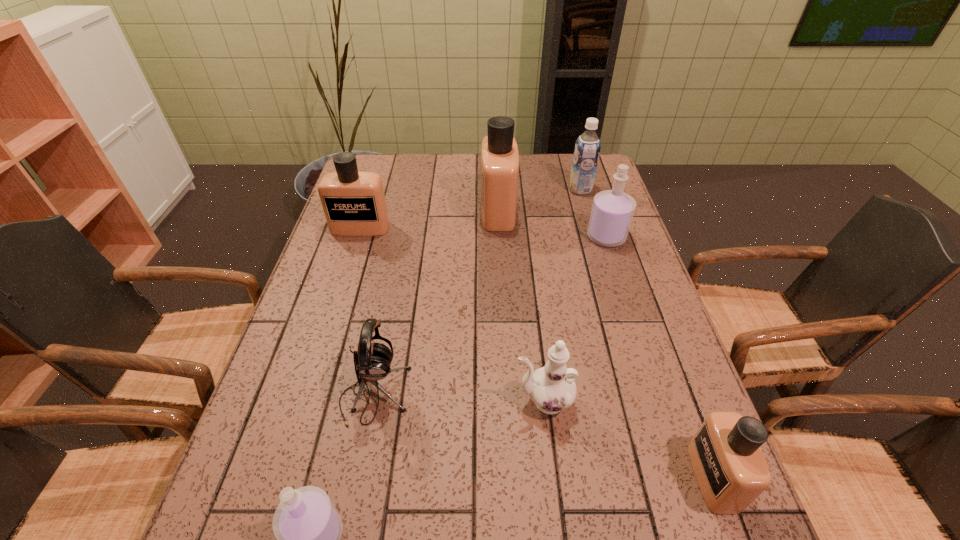
This screenshot has width=960, height=540. In order to click on vacant area at the far edge in this screenshot , I will do `click(460, 180)`.

Find the location of a particular element. free space at the left edge is located at coordinates (365, 282).

Identify the location of vacant area at the right edge. (581, 211).

The width and height of the screenshot is (960, 540). Identify the location of vacant region at the far left corner. (396, 157).

Image resolution: width=960 pixels, height=540 pixels. Identify the location of empty space that is in between the nearest beige perfume and the tallest perfume. (606, 344).

Identify the location of empty location between the second beige perfume from right to left and the black earphone. (436, 303).

Locate an element on the screen. This screenshot has height=540, width=960. empty location between the chinaware and the farther purple perfume is located at coordinates (575, 319).

The width and height of the screenshot is (960, 540). What are the coordinates of `free space between the second biggest beige perfume and the tallest perfume` in the screenshot? It's located at (429, 219).

The width and height of the screenshot is (960, 540). Identify the location of unoccupied position between the leftmost beige perfume and the soya milk. (470, 208).

You are a GUI agent. You are given a task and a screenshot of the screen. Output one action in this format:
    pyautogui.click(x=<x>, y=<y>)
    Task: Click on the free area in between the leftmost beige perfume and the black earphone
    The image size is (960, 540).
    Given the screenshot: What is the action you would take?
    pyautogui.click(x=368, y=312)